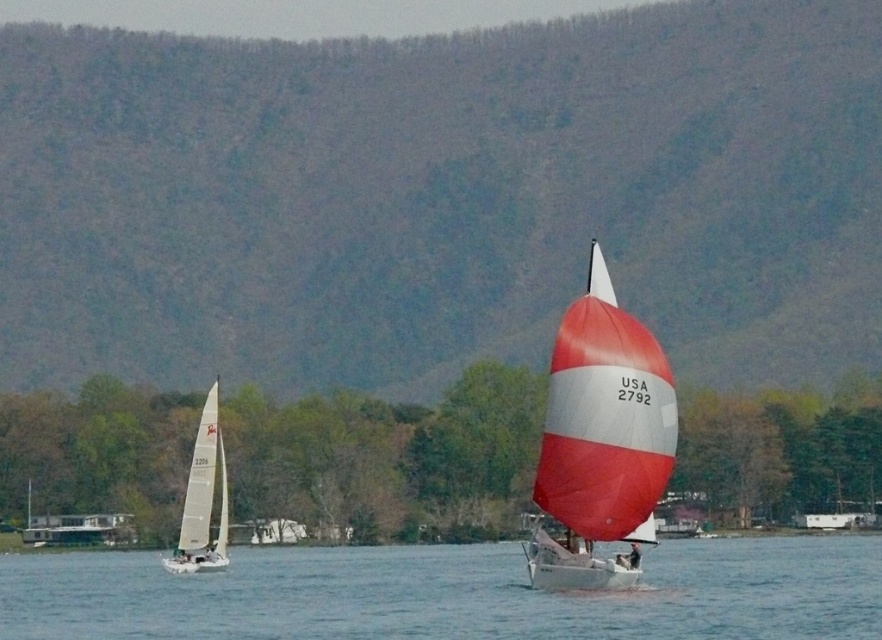
Question: From the image, what is the correct spatial relationship of clear blue water at center in relation to red and white striped sailboat at center?

Choices:
 (A) below
 (B) above

Answer: (A)

Question: Can you confirm if clear blue water at center is wider than white matte sailboat at left?

Choices:
 (A) no
 (B) yes

Answer: (B)

Question: Among these points, which one is nearest to the camera?

Choices:
 (A) (214, 560)
 (B) (544, 488)
 (C) (476, 605)

Answer: (B)

Question: Is clear blue water at center in front of red and white striped sailboat at center?

Choices:
 (A) no
 (B) yes

Answer: (B)

Question: Which of the following is the closest to the observer?

Choices:
 (A) (558, 412)
 (B) (390, 637)
 (C) (208, 410)

Answer: (A)

Question: Which point is closer to the camera?

Choices:
 (A) clear blue water at center
 (B) red and white striped sailboat at center

Answer: (A)